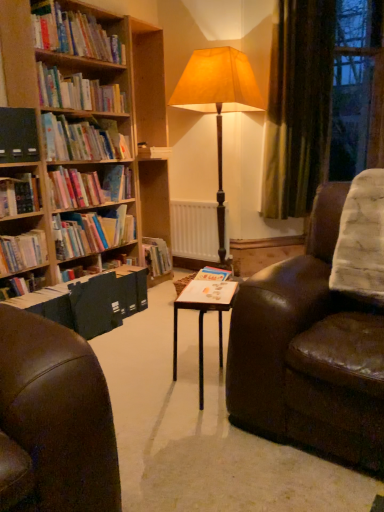
Identify the location of vacant space in front of white wooden table at center. The width and height of the screenshot is (384, 512). (197, 442).